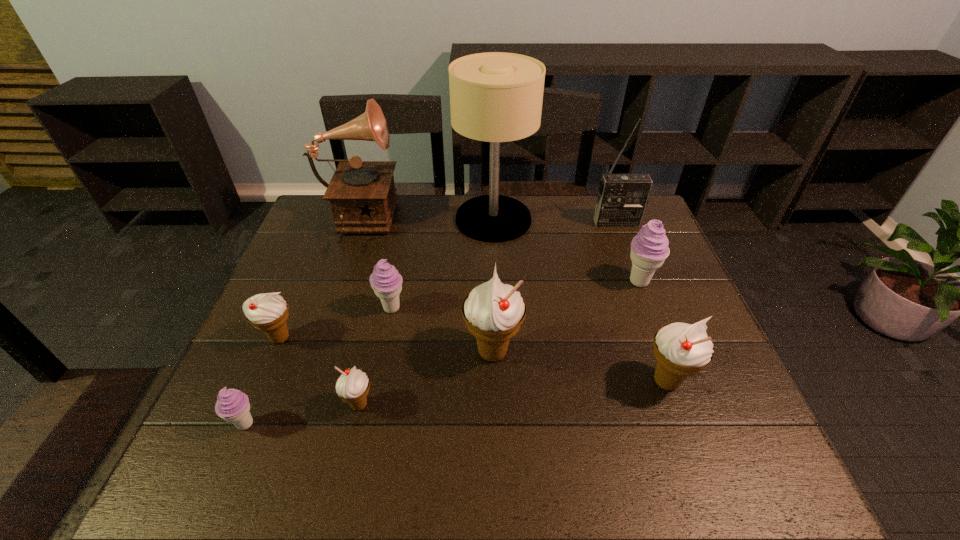
Identify the location of white icecream that is the third closest to the third biggest white icecream. The image size is (960, 540). 680,349.

At what (x,y) coordinates should I click in order to perform the action: click on purple icecream that is the second closest to the farthest purple icecream. Please return your answer as a coordinate pair (x, y). The height and width of the screenshot is (540, 960). Looking at the image, I should click on (232, 405).

Identify which purple icecream is the nearest to the nearest purple icecream. Please provide its 2D coordinates. Your answer should be formatted as a tuple, i.e. [(x, y)], where the tuple contains the x and y coordinates of a point satisfying the conditions above.

[(385, 280)]

Image resolution: width=960 pixels, height=540 pixels. I want to click on vacant point that satisfies the following two spatial constraints: 1. on the horn of the brown record player; 2. on the back side of the second smallest purple icecream, so click(x=328, y=308).

Locate an element on the screen. The height and width of the screenshot is (540, 960). vacant region that satisfies the following two spatial constraints: 1. on the back side of the leftmost purple icecream; 2. on the left side of the rightmost white icecream is located at coordinates click(264, 381).

Locate an element on the screen. blank area in the image that satisfies the following two spatial constraints: 1. on the horn of the record player; 2. on the right side of the third white icecream from right to left is located at coordinates (295, 405).